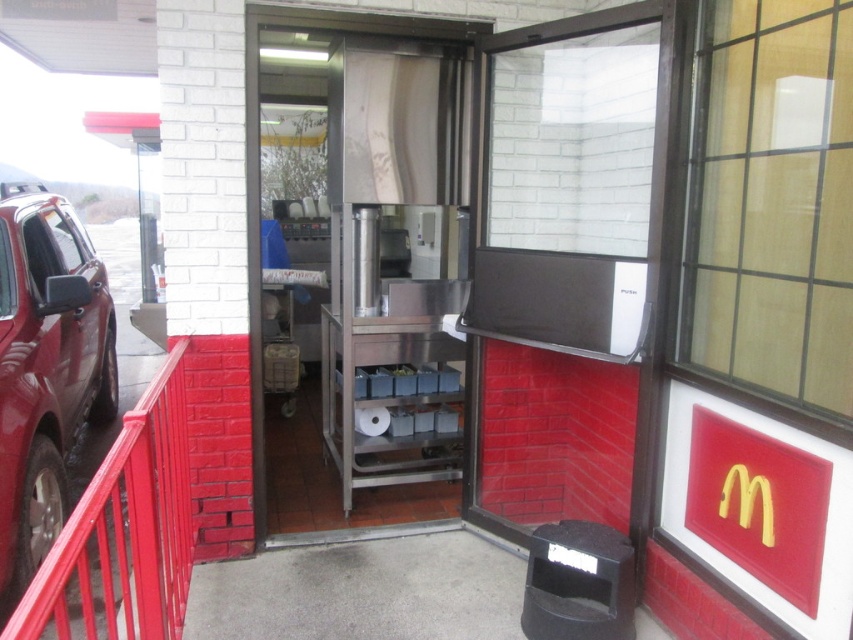
Question: Based on their relative distances, which object is farther from the shiny dark red suv at left?

Choices:
 (A) red metal railing at left
 (B) clear glass door at center

Answer: (B)

Question: Observing the image, what is the correct spatial positioning of clear glass door at center in reference to shiny dark red suv at left?

Choices:
 (A) below
 (B) above

Answer: (B)

Question: Which point appears closest to the camera in this image?

Choices:
 (A) (132, 420)
 (B) (735, 378)

Answer: (A)

Question: Can you confirm if clear glass door at center is positioned to the left of red metal railing at left?

Choices:
 (A) no
 (B) yes

Answer: (A)

Question: Estimate the real-world distances between objects in this image. Which object is farther from the clear glass door at center?

Choices:
 (A) shiny dark red suv at left
 (B) red metal railing at left

Answer: (A)

Question: Does clear glass door at center have a lesser width compared to red metal railing at left?

Choices:
 (A) no
 (B) yes

Answer: (B)